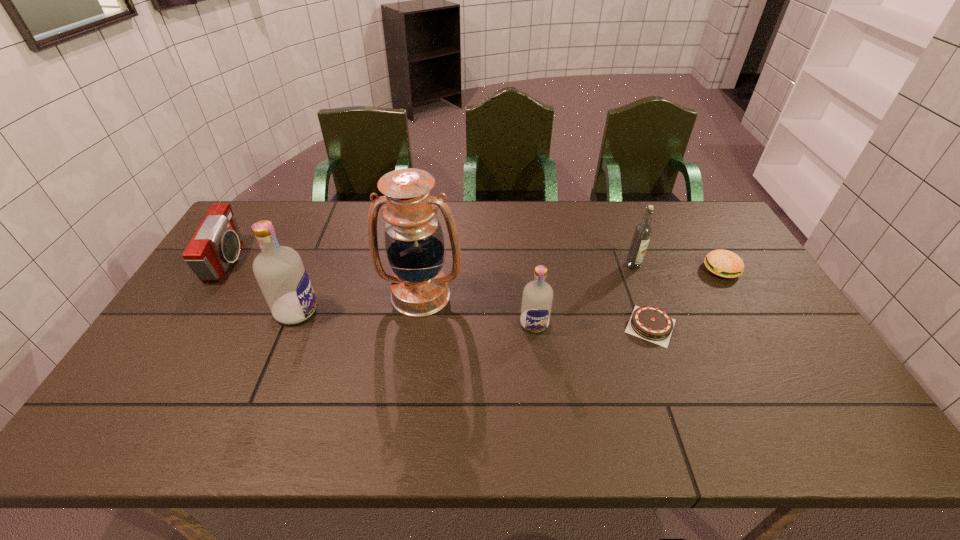
Locate an element on the screen. free spot between the second object from left to right and the farthest vodka is located at coordinates (465, 288).

Where is `free space between the patty and the chocolate cake`? free space between the patty and the chocolate cake is located at coordinates (686, 298).

Where is `free spot between the sixth tallest object and the second object from left to right`? This screenshot has height=540, width=960. free spot between the sixth tallest object and the second object from left to right is located at coordinates (509, 291).

Find the location of `vacant region between the second vodka from left to right and the farthest vodka`. vacant region between the second vodka from left to right and the farthest vodka is located at coordinates (584, 294).

Locate an element on the screen. The width and height of the screenshot is (960, 540). vacant region between the chocolate cake and the rightmost vodka is located at coordinates (641, 296).

Locate an element on the screen. The image size is (960, 540). the second closest object to the rightmost object is located at coordinates (643, 231).

Identify which object is located as the fourth nearest to the chocolate cake. Please provide its 2D coordinates. Your answer should be formatted as a tuple, i.e. [(x, y)], where the tuple contains the x and y coordinates of a point satisfying the conditions above.

[(414, 242)]

Locate an element on the screen. the closest vodka relative to the rightmost vodka is located at coordinates (537, 297).

Identify which vodka is the third closest to the fifth object from right to left. Please provide its 2D coordinates. Your answer should be formatted as a tuple, i.e. [(x, y)], where the tuple contains the x and y coordinates of a point satisfying the conditions above.

[(643, 231)]

This screenshot has height=540, width=960. Identify the location of vacant space that satisfies the following two spatial constraints: 1. on the front-facing side of the third shortest object; 2. on the right side of the chocolate cake. (187, 326).